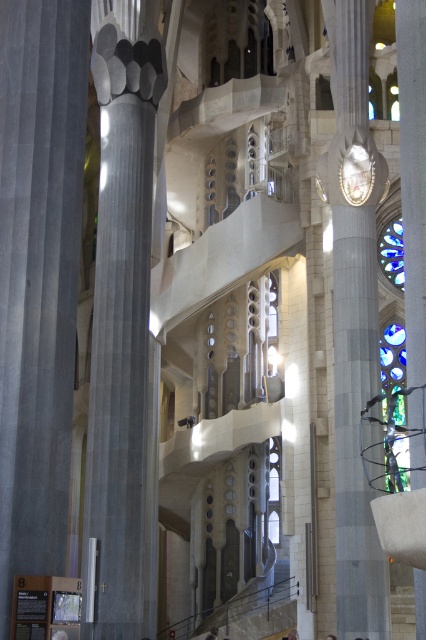
Consider the image. Between gray stone column at left and gray stone pillar at right, which one is positioned lower?

gray stone column at left is below.

Between point (72, 262) and point (362, 243), which one is positioned behind?

Point (362, 243)

This screenshot has width=426, height=640. What are the coordinates of `gray stone column at left` in the screenshot? It's located at (39, 276).

Which of these two, slate gray stone column at left or blue stained glass at right, stands taller?

slate gray stone column at left is taller.

Can you confirm if slate gray stone column at left is bigger than blue stained glass at right?

Yes.

Describe the element at coordinates (120, 314) in the screenshot. The image size is (426, 640). I see `slate gray stone column at left` at that location.

Locate an element on the screen. The width and height of the screenshot is (426, 640). slate gray stone column at left is located at coordinates (120, 314).

Is gray stone column at left to the left of blue stained glass at right from the viewer's perspective?

Yes, gray stone column at left is to the left of blue stained glass at right.

Is the position of gray stone column at left more distant than that of blue stained glass at right?

No, gray stone column at left is closer to the viewer.

Locate an element on the screen. gray stone column at left is located at coordinates (39, 276).

This screenshot has width=426, height=640. Identify the location of gray stone column at left. 39,276.